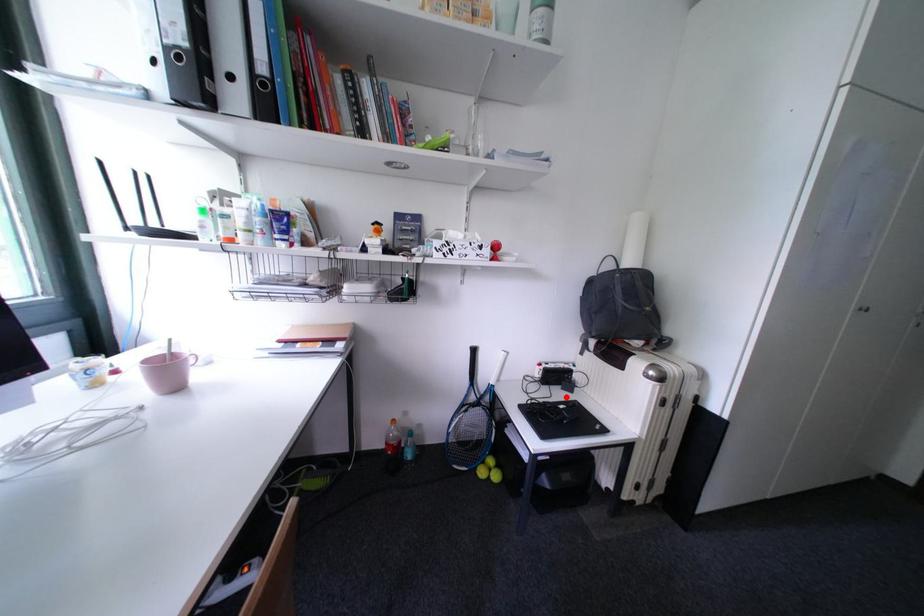
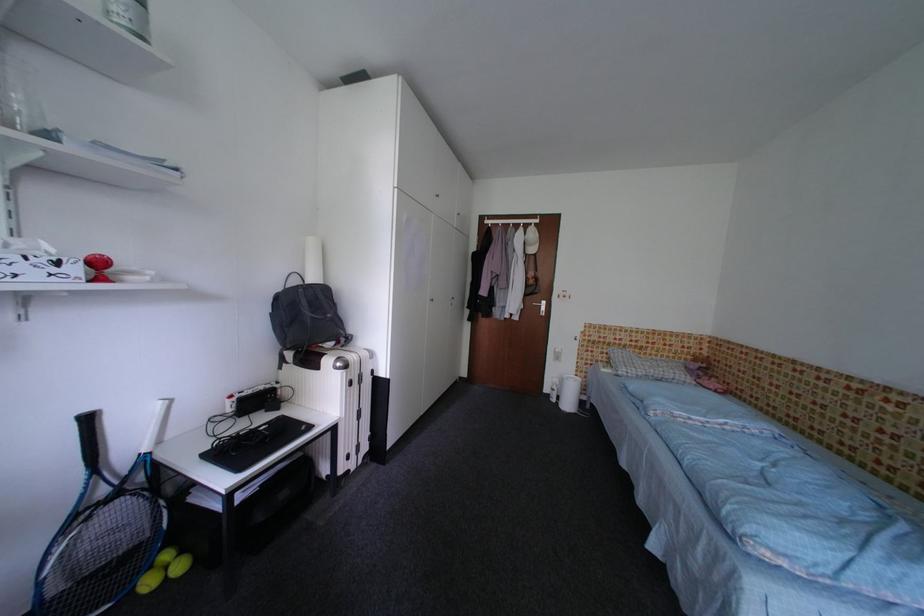
Question: I am providing you with two images of the same scene from different viewpoints. Given a red point in image1, look at the same physical point in image2. Is it:

Choices:
 (A) Closer to the viewpoint
 (B) Farther from the viewpoint

Answer: (A)